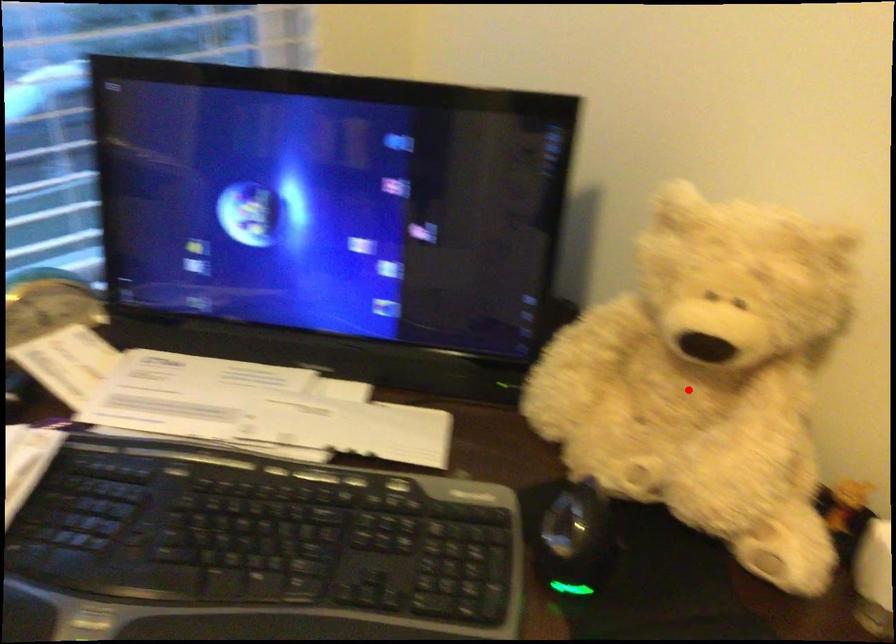
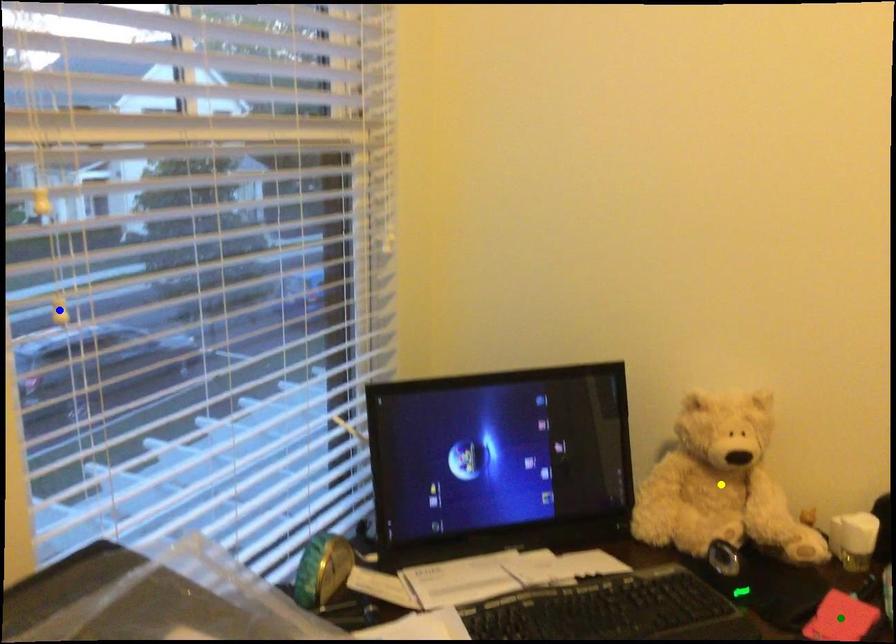
Question: I am providing you with two images of the same scene from different viewpoints. A red point is marked on the first image. You are given multiple points on the second image. Which point in image 2 represents the same 3d spot as the red point in image 1?

Choices:
 (A) yellow point
 (B) blue point
 (C) green point

Answer: (A)